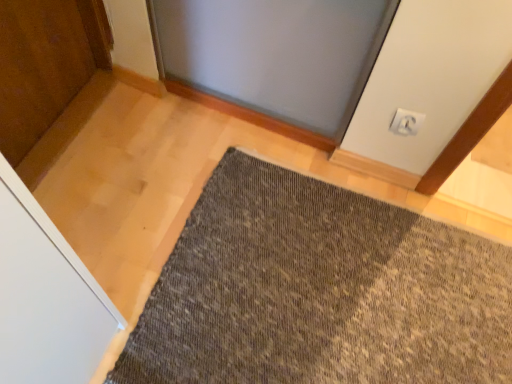
Question: Can you confirm if textured gray mat at center is smaller than white plastic electric outlet at upper right?

Choices:
 (A) yes
 (B) no

Answer: (B)

Question: Is the position of textured gray mat at center more distant than that of white plastic electric outlet at upper right?

Choices:
 (A) no
 (B) yes

Answer: (A)

Question: Can white plastic electric outlet at upper right be found inside textured gray mat at center?

Choices:
 (A) no
 (B) yes

Answer: (A)

Question: Can you confirm if textured gray mat at center is taller than white plastic electric outlet at upper right?

Choices:
 (A) yes
 (B) no

Answer: (B)

Question: Would you say textured gray mat at center is a long distance from white plastic electric outlet at upper right?

Choices:
 (A) yes
 (B) no

Answer: (B)

Question: Is textured gray mat at center to the left of white plastic electric outlet at upper right from the viewer's perspective?

Choices:
 (A) no
 (B) yes

Answer: (B)

Question: Is white plastic electric outlet at upper right behind textured gray mat at center?

Choices:
 (A) no
 (B) yes

Answer: (B)

Question: Are white plastic electric outlet at upper right and textured gray mat at center far apart?

Choices:
 (A) yes
 (B) no

Answer: (B)

Question: Is white plastic electric outlet at upper right placed right next to textured gray mat at center?

Choices:
 (A) no
 (B) yes

Answer: (A)

Question: Is white plastic electric outlet at upper right at the left side of textured gray mat at center?

Choices:
 (A) no
 (B) yes

Answer: (A)

Question: Can you confirm if white plastic electric outlet at upper right is bigger than textured gray mat at center?

Choices:
 (A) no
 (B) yes

Answer: (A)

Question: Is white plastic electric outlet at upper right wider than textured gray mat at center?

Choices:
 (A) no
 (B) yes

Answer: (A)

Question: Is white plastic electric outlet at upper right taller or shorter than textured gray mat at center?

Choices:
 (A) short
 (B) tall

Answer: (B)